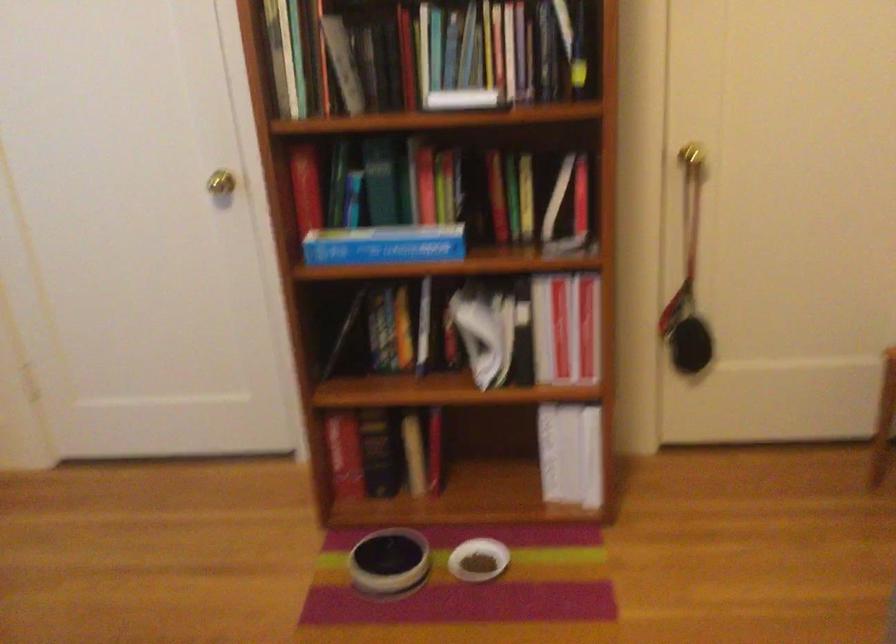
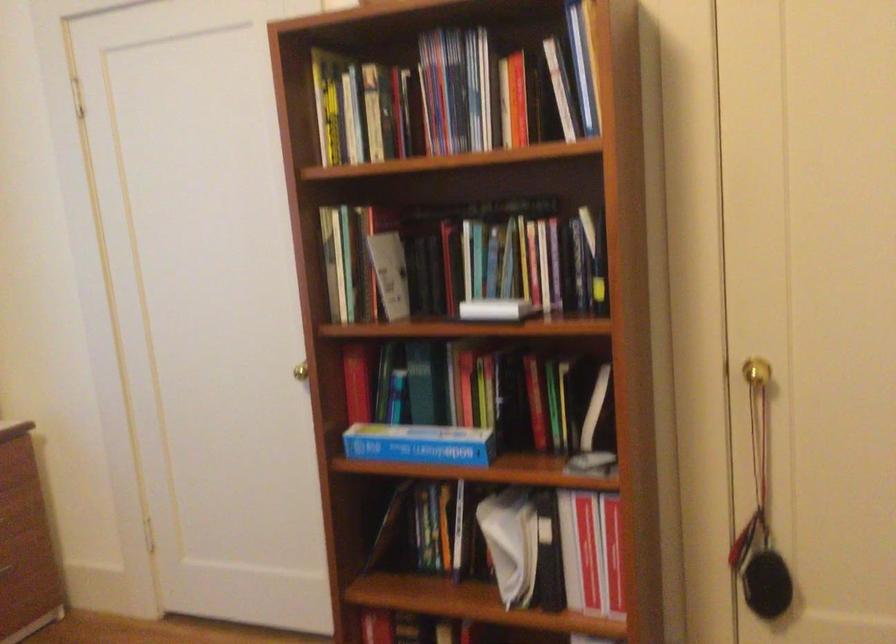
Find the pixel in the second image that matches (x=470, y=96) in the first image.

(495, 308)